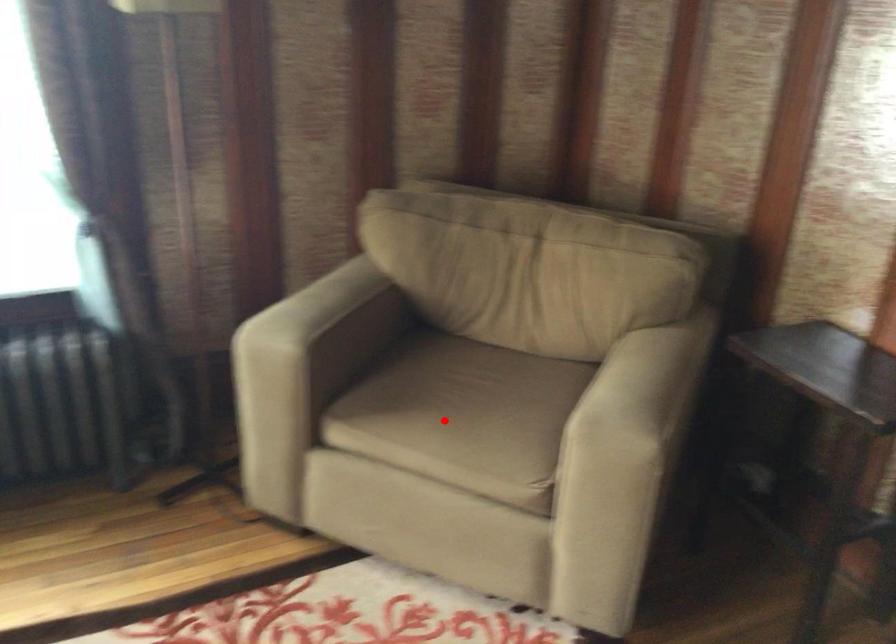
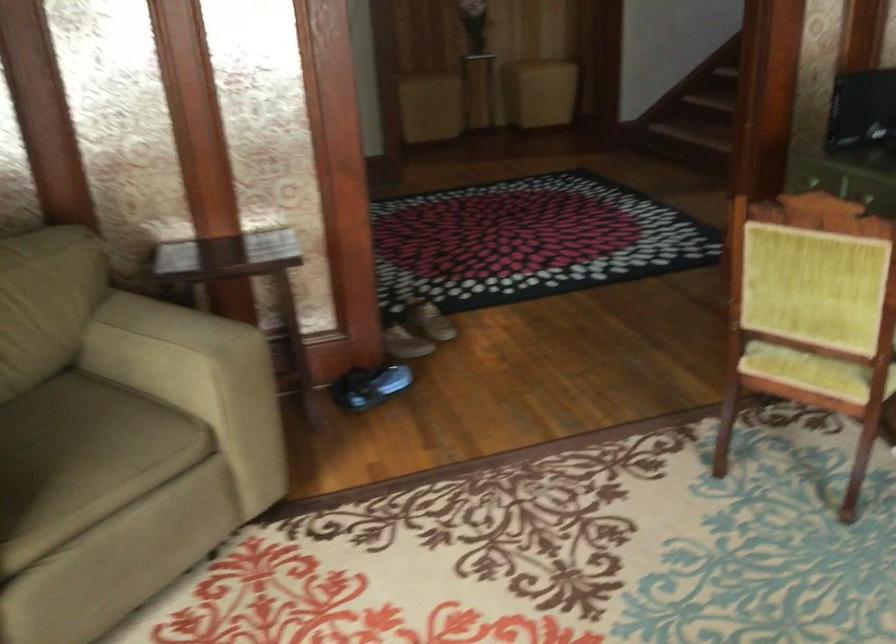
Locate, in the second image, the point that corresponds to the highlighted location in the first image.

(82, 459)